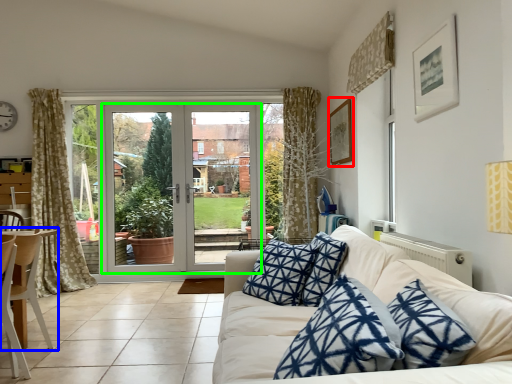
Question: Which is farther away from picture frame (highlighted by a red box)? chair (highlighted by a blue box) or door (highlighted by a green box)?

Choices:
 (A) chair
 (B) door

Answer: (A)